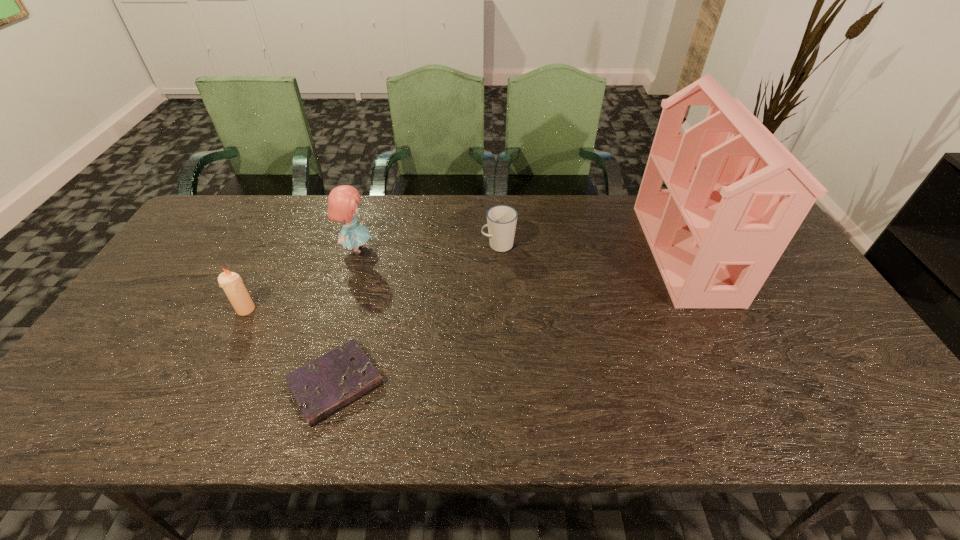
Where is `vacant space that is in between the fourth shortest object and the second object from right to left`? The height and width of the screenshot is (540, 960). vacant space that is in between the fourth shortest object and the second object from right to left is located at coordinates (427, 247).

Identify the location of free space that is in between the doll and the rightmost object. Image resolution: width=960 pixels, height=540 pixels. (520, 251).

Where is `vacant area between the doll and the nearest object`? This screenshot has width=960, height=540. vacant area between the doll and the nearest object is located at coordinates (346, 316).

At what (x,y) coordinates should I click in order to perform the action: click on unoccupied area between the shortest object and the fourth tallest object. Please return your answer as a coordinate pair (x, y). Looking at the image, I should click on (417, 314).

Image resolution: width=960 pixels, height=540 pixels. Identify the location of unoccupied position between the tallest object and the fourth tallest object. (591, 249).

You are a GUI agent. You are given a task and a screenshot of the screen. Output one action in this format:
    pyautogui.click(x=<x>, y=<y>)
    Task: Click on the blank region between the leftmost object and the dollhouse
    Image resolution: width=960 pixels, height=540 pixels.
    Given the screenshot: What is the action you would take?
    pyautogui.click(x=466, y=281)

This screenshot has height=540, width=960. I want to click on object that is the closest to the nearest object, so click(231, 282).

Locate which object is the third closest to the dollhouse. Please provide its 2D coordinates. Your answer should be formatted as a tuple, i.e. [(x, y)], where the tuple contains the x and y coordinates of a point satisfying the conditions above.

[(342, 202)]

Locate an element on the screen. free region that satisfies the following two spatial constraints: 1. with a handle on the side of the second shortest object; 2. on the front side of the candle is located at coordinates (501, 309).

At what (x,y) coordinates should I click in order to perform the action: click on vacant position in the image that satisfies the following two spatial constraints: 1. on the front-facing side of the doll; 2. on the right side of the shortest object. Please return your answer as a coordinate pair (x, y). Looking at the image, I should click on (317, 383).